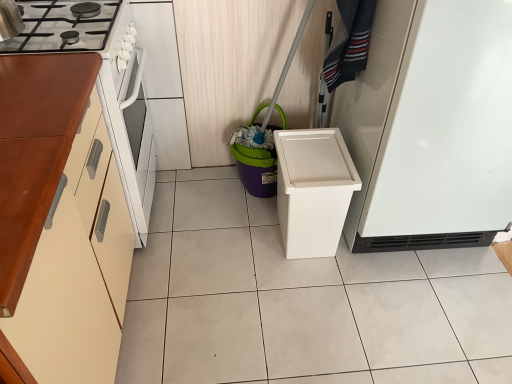
Describe the element at coordinates (256, 169) in the screenshot. I see `purple plastic bucket at center` at that location.

Locate an element on the screen. This screenshot has height=384, width=512. wooden cabinet at left is located at coordinates click(x=59, y=224).

This screenshot has height=384, width=512. Identify the location of purple plastic bucket at center. (256, 169).

From a real-world perspective, is denim fabric laundry at upper right above or below wooden cabinet at left?

denim fabric laundry at upper right is above wooden cabinet at left.

Is denim fabric laundry at upper right directly adjacent to wooden cabinet at left?

There is a gap between denim fabric laundry at upper right and wooden cabinet at left.

Consider the image. Is denim fabric laundry at upper right further to camera compared to wooden cabinet at left?

Yes, it is behind wooden cabinet at left.

In the scene shown: Considering the sizes of objects denim fabric laundry at upper right and wooden cabinet at left in the image provided, who is shorter, denim fabric laundry at upper right or wooden cabinet at left?

denim fabric laundry at upper right is shorter.

Considering the relative positions of purple plastic bucket at center and denim fabric laundry at upper right in the image provided, is purple plastic bucket at center to the right of denim fabric laundry at upper right from the viewer's perspective?

Incorrect, purple plastic bucket at center is not on the right side of denim fabric laundry at upper right.

Is point (238, 172) positioned in front of point (347, 62)?

No, (238, 172) is behind (347, 62).

Based on their sizes in the image, would you say purple plastic bucket at center is bigger or smaller than denim fabric laundry at upper right?

purple plastic bucket at center is bigger than denim fabric laundry at upper right.

Considering the relative positions of purple plastic bucket at center and denim fabric laundry at upper right in the image provided, is purple plastic bucket at center in front of denim fabric laundry at upper right?

No, it is not.

Does purple plastic bucket at center contain wooden cabinet at left?

No, wooden cabinet at left is located outside of purple plastic bucket at center.

From the image's perspective, between purple plastic bucket at center and wooden cabinet at left, which one is located above?

purple plastic bucket at center.

Consider the image. Is purple plastic bucket at center thinner than wooden cabinet at left?

Yes.

Is purple plastic bucket at center not close to wooden cabinet at left?

No, purple plastic bucket at center is in close proximity to wooden cabinet at left.

Is white matte refrigerator at right at the back of purple plastic bucket at center?

No.

Is purple plastic bucket at center wider than white matte refrigerator at right?

Incorrect, the width of purple plastic bucket at center does not surpass that of white matte refrigerator at right.

Which is further, (267, 188) or (487, 244)?

The point (267, 188) is behind.

Is purple plastic bucket at center positioned before white matte refrigerator at right?

That is False.

From a real-world perspective, which object stands above the other?

From a 3D spatial view, white matte refrigerator at right is above.

Considering the relative sizes of white matte refrigerator at right and purple plastic bucket at center in the image provided, is white matte refrigerator at right wider than purple plastic bucket at center?

Yes, white matte refrigerator at right is wider than purple plastic bucket at center.

Between white matte refrigerator at right and purple plastic bucket at center, which one appears on the left side from the viewer's perspective?

purple plastic bucket at center.

Based on the photo, between white matte refrigerator at right and purple plastic bucket at center, which one has larger size?

With larger size is white matte refrigerator at right.

From a real-world perspective, is denim fabric laundry at upper right above or below purple plastic bucket at center?

Clearly, from a real-world perspective, denim fabric laundry at upper right is above purple plastic bucket at center.

Is the position of denim fabric laundry at upper right less distant than that of purple plastic bucket at center?

Yes.

From the image's perspective, is denim fabric laundry at upper right above or below purple plastic bucket at center?

denim fabric laundry at upper right is situated higher than purple plastic bucket at center in the image.

Measure the distance from denim fabric laundry at upper right to purple plastic bucket at center.

denim fabric laundry at upper right and purple plastic bucket at center are 19.86 inches apart.

Relative to purple plastic bucket at center, is wooden cabinet at left in front or behind?

wooden cabinet at left is positioned closer to the viewer than purple plastic bucket at center.

From the image's perspective, is wooden cabinet at left positioned above or below purple plastic bucket at center?

wooden cabinet at left is below purple plastic bucket at center.

Is wooden cabinet at left oriented towards purple plastic bucket at center?

No, wooden cabinet at left does not turn towards purple plastic bucket at center.

Does wooden cabinet at left have a lesser height compared to purple plastic bucket at center?

Incorrect, the height of wooden cabinet at left does not fall short of that of purple plastic bucket at center.

Find the location of a particular element. laundry above the wooden cabinet at left (from a real-world perspective) is located at coordinates click(349, 42).

Where is `appliance located underneath the denim fabric laundry at upper right (from a real-world perspective)`? appliance located underneath the denim fabric laundry at upper right (from a real-world perspective) is located at coordinates (256, 169).

Which object lies nearer to the anchor point white matte refrigerator at right, purple plastic bucket at center or denim fabric laundry at upper right?

denim fabric laundry at upper right.

Which object lies nearer to the anchor point wooden cabinet at left, white matte refrigerator at right or denim fabric laundry at upper right?

denim fabric laundry at upper right is closer to wooden cabinet at left.

Looking at the image, which one is located further to purple plastic bucket at center, white matte refrigerator at right or denim fabric laundry at upper right?

white matte refrigerator at right is further to purple plastic bucket at center.

Which object lies nearer to the anchor point denim fabric laundry at upper right, white matte refrigerator at right or wooden cabinet at left?

The object closer to denim fabric laundry at upper right is white matte refrigerator at right.

Which object lies nearer to the anchor point denim fabric laundry at upper right, purple plastic bucket at center or wooden cabinet at left?

Among the two, purple plastic bucket at center is located nearer to denim fabric laundry at upper right.

When comparing their distances from white matte refrigerator at right, does wooden cabinet at left or denim fabric laundry at upper right seem further?

wooden cabinet at left is further to white matte refrigerator at right.

Considering their positions, is purple plastic bucket at center positioned further to wooden cabinet at left than denim fabric laundry at upper right?

denim fabric laundry at upper right lies further to wooden cabinet at left than the other object.

Estimate the real-world distances between objects in this image. Which object is closer to purple plastic bucket at center, denim fabric laundry at upper right or wooden cabinet at left?

denim fabric laundry at upper right is closer to purple plastic bucket at center.

This screenshot has width=512, height=384. Identify the location of appliance situated between wooden cabinet at left and white matte refrigerator at right from left to right. (256, 169).

This screenshot has width=512, height=384. Identify the location of laundry between white matte refrigerator at right and purple plastic bucket at center in the front-back direction. (349, 42).

The image size is (512, 384). I want to click on laundry located between wooden cabinet at left and purple plastic bucket at center in the depth direction, so click(x=349, y=42).

Identify the location of laundry between wooden cabinet at left and white matte refrigerator at right in the horizontal direction. This screenshot has height=384, width=512. (349, 42).